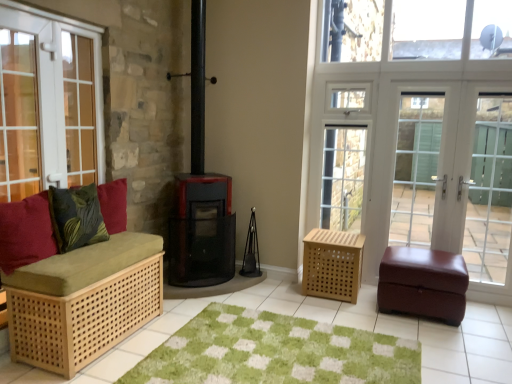
Find the location of a particular element. This screenshot has width=512, height=384. blank space above light brown woven basket at center-right, the second furniture when ordered from right to left (from a real-world perspective) is located at coordinates (337, 234).